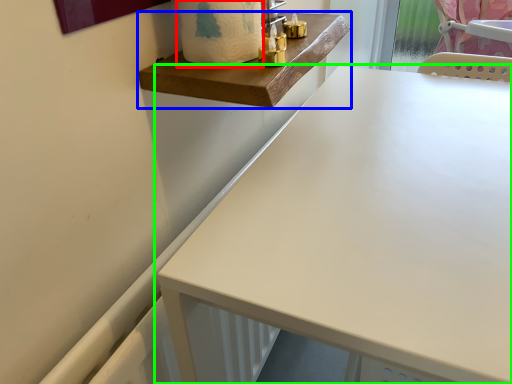
Question: Considering the real-world distances, which object is closest to toilet paper (highlighted by a red box)? changing table (highlighted by a blue box) or table (highlighted by a green box).

Choices:
 (A) changing table
 (B) table

Answer: (A)